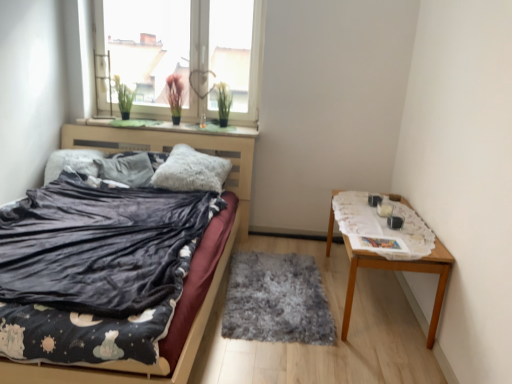
I want to click on free space in front of fuzzy gray rug at center, so click(298, 357).